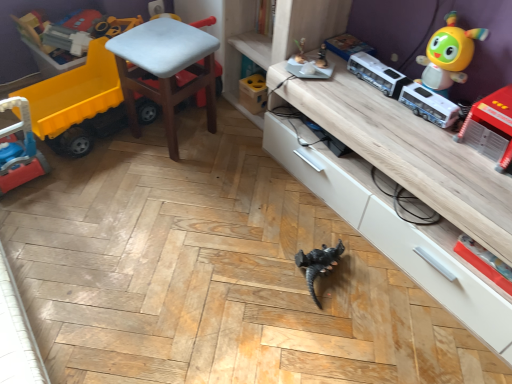
Identify the location of vacant area that is in front of white plastic bus at upper right. The width and height of the screenshot is (512, 384). (414, 133).